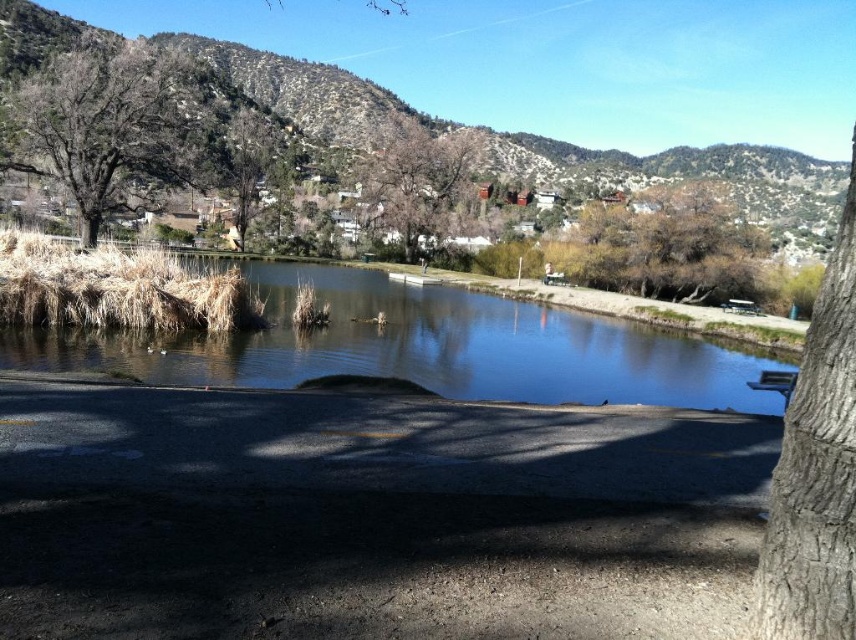
You are a painter setting up your easel to paint the scene. You want to capture the brown rough bark tree at right and the wooden park bench at right in your painting. Which object should you place wider in your painting to accurately reflect their actual sizes?

You should make the brown rough bark tree at right wider in your painting since its actual width surpasses that of the wooden park bench at right.

You are standing at the center of the paved path in the scene. Which direction should you walk to reach the brown rough bark tree at right?

You should walk to the right to reach the brown rough bark tree at right since it is located at the right side of the frame.

Based on the photo, you are a painter setting up your easel to paint the scene. You want to include both the brown rough bark tree at right and the wooden park bench at right in your painting. Which object should you focus on first to capture its full height?

The brown rough bark tree at right is much taller than the wooden park bench at right, so you should focus on capturing the tree first to ensure its full height is included in the painting.